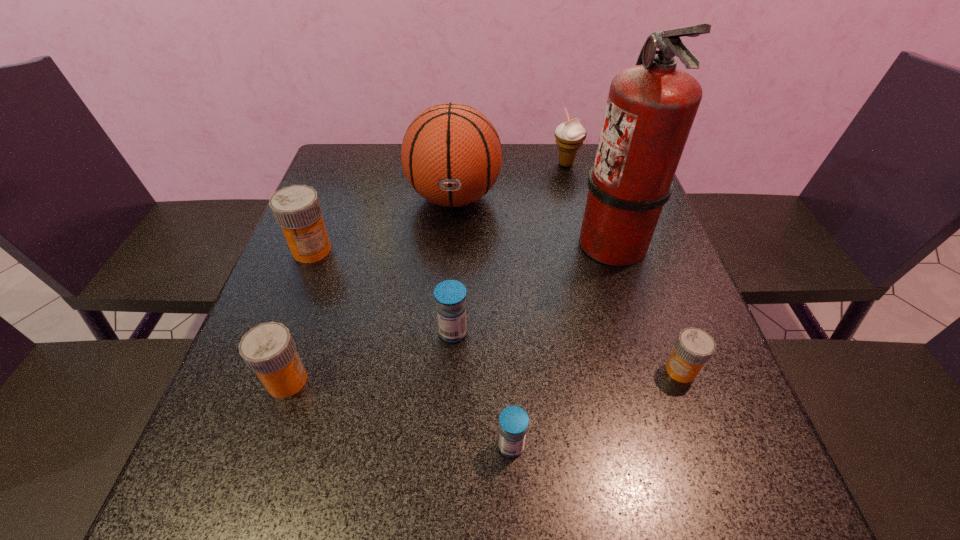
The width and height of the screenshot is (960, 540). Identify the location of blank space located 0.400m on the label side of the second smallest orange medicine. (530, 381).

Locate an element on the screen. The image size is (960, 540). vacant space located 0.150m on the front of the bigger blue medicine is located at coordinates (448, 418).

Where is `free location located on the label side of the smallest orange medicine`? free location located on the label side of the smallest orange medicine is located at coordinates (584, 370).

The height and width of the screenshot is (540, 960). What are the coordinates of `free space located on the label side of the smallest orange medicine` in the screenshot? It's located at (556, 370).

At what (x,y) coordinates should I click in order to perform the action: click on free location located 0.270m on the label side of the smallest orange medicine. Please return your answer as a coordinate pair (x, y). Looking at the image, I should click on (518, 370).

I want to click on free region located on the left of the nearest medicine, so click(x=448, y=446).

Where is `basketball at the far edge`? basketball at the far edge is located at coordinates point(451,154).

I want to click on icecream positioned at the far edge, so click(569, 135).

Locate an element on the screen. Image resolution: width=960 pixels, height=540 pixels. fire extinguisher present at the right edge is located at coordinates (651, 107).

Find the location of a particular element. The width and height of the screenshot is (960, 540). icecream at the right edge is located at coordinates (569, 135).